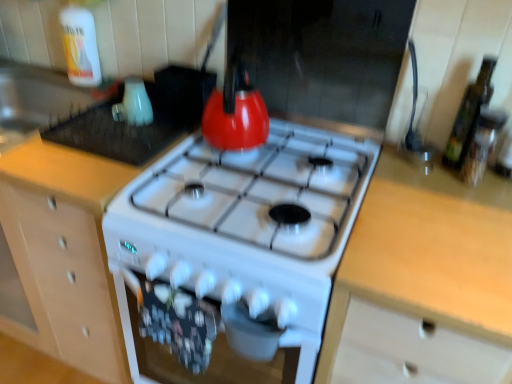
I want to click on free space in front of green glass bottle at right, the second bottle viewed from the left, so click(x=457, y=200).